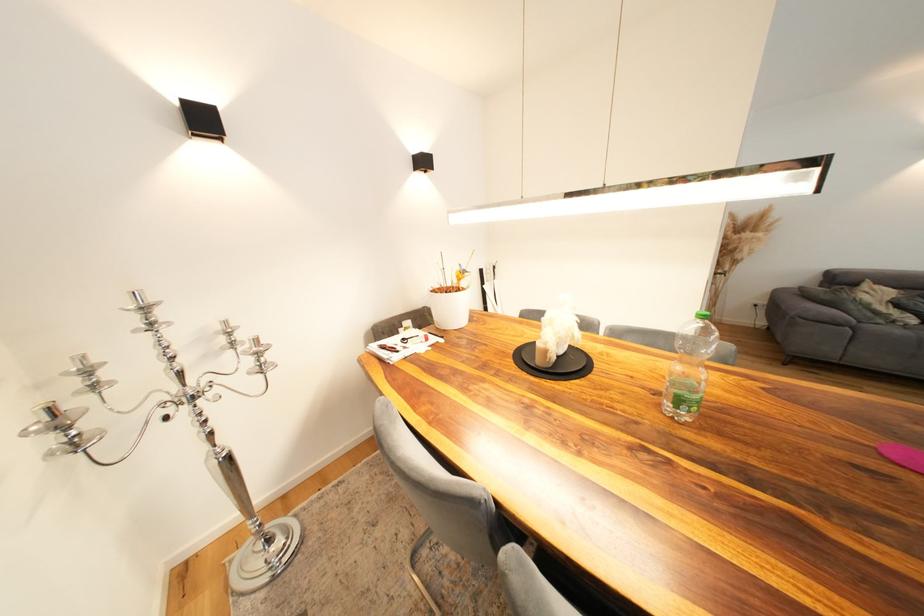
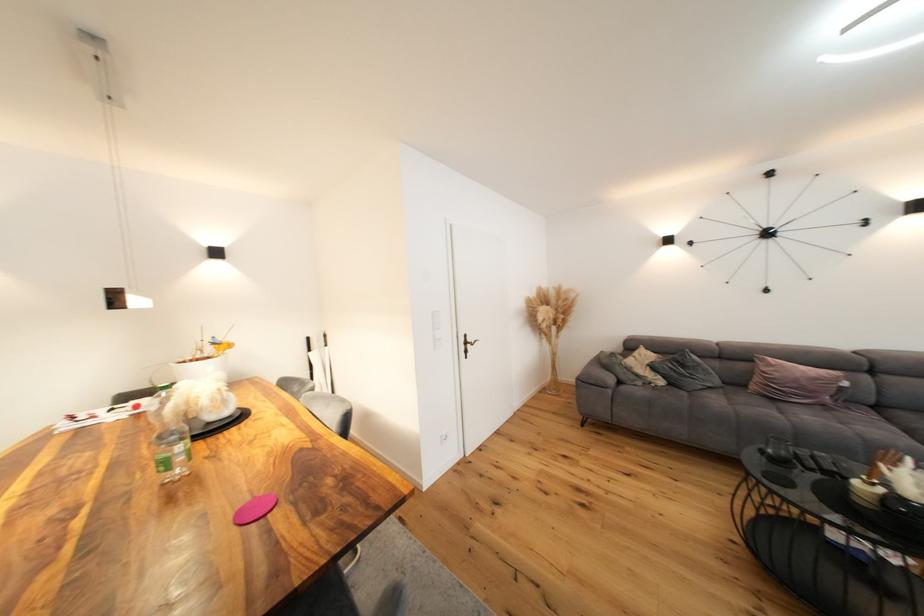
Question: The images are taken continuously from a first-person perspective. In which direction are you moving?

Choices:
 (A) Left
 (B) Right
 (C) Forward
 (D) Backward

Answer: (B)